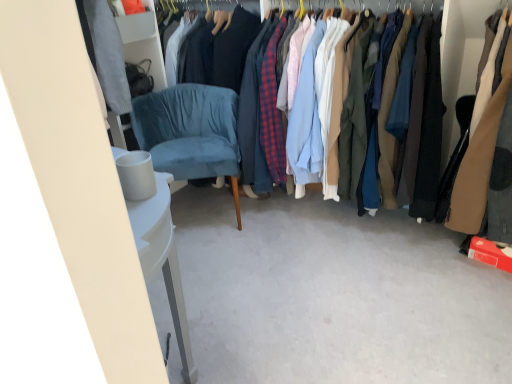
Find the location of a particular element. Image resolution: width=512 pixels, height=384 pixels. free space in front of matte cotton shirts at center, arranged as the 1th clothing when viewed from the left is located at coordinates (351, 300).